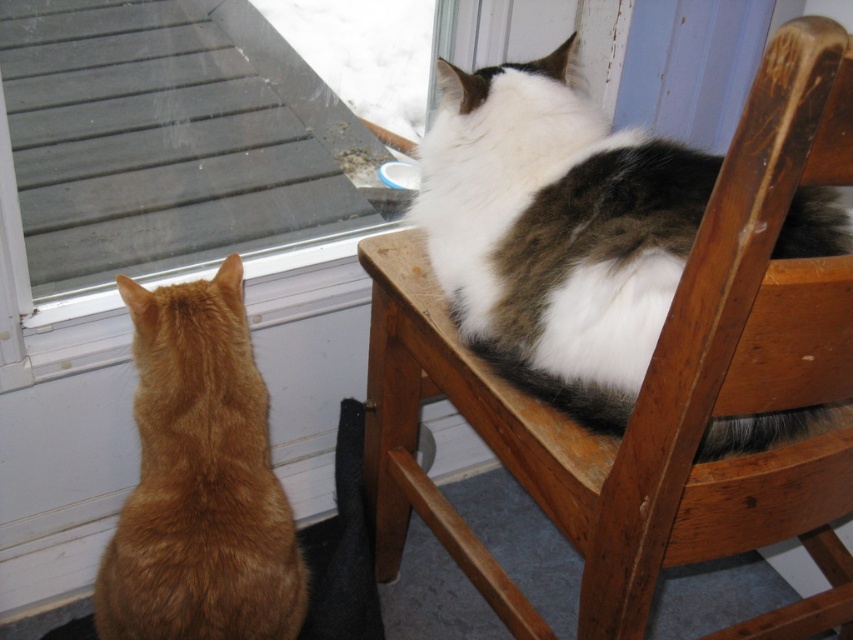
Based on the photo, can you confirm if wooden chair at upper right is positioned to the right of orange fur cat at left?

Indeed, wooden chair at upper right is positioned on the right side of orange fur cat at left.

Is point (697, 435) farther from viewer compared to point (178, 602)?

No, (697, 435) is closer to viewer.

Where is `wooden chair at upper right`? This screenshot has width=853, height=640. wooden chair at upper right is located at coordinates (657, 388).